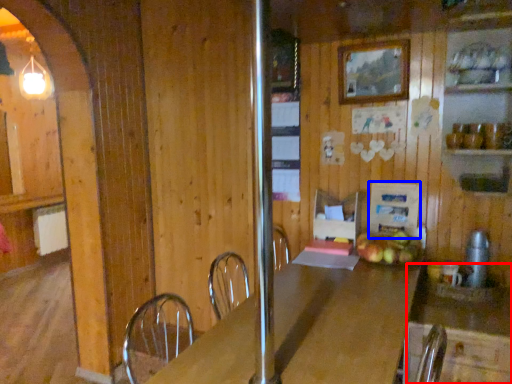
Question: Which object appears farthest to the camera in this image, counter (highlighted by a red box) or appliance (highlighted by a blue box)?

Choices:
 (A) counter
 (B) appliance

Answer: (B)